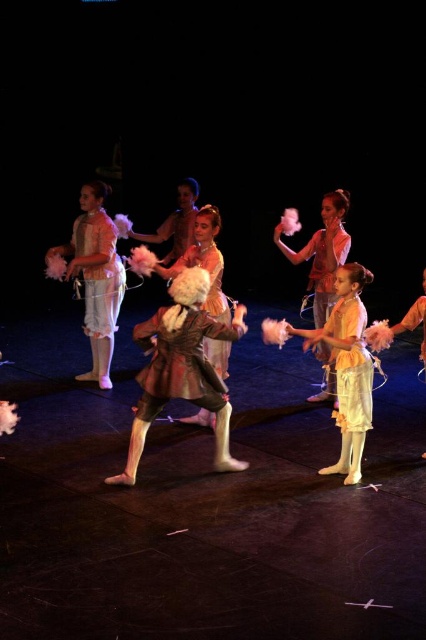
Question: Which point appears closest to the camera in this image?

Choices:
 (A) (101, 221)
 (B) (347, 376)
 (C) (218, 312)

Answer: (B)

Question: Where is matte orange dress at center located in relation to shiny silver dress at center in the image?

Choices:
 (A) below
 (B) above

Answer: (B)

Question: Which of the following is the closest to the observer?

Choices:
 (A) (325, 376)
 (B) (97, 204)

Answer: (B)

Question: Which object is the farthest from the matte pink tutu at center?

Choices:
 (A) matte yellow dress at center
 (B) shiny silver dress at center

Answer: (A)

Question: Can you confirm if matte orange dress at center is thinner than shiny silver dress at center?

Choices:
 (A) yes
 (B) no

Answer: (B)

Question: Considering the relative positions of matte yellow dress at center and shiny silver dress at center in the image provided, where is matte yellow dress at center located with respect to shiny silver dress at center?

Choices:
 (A) above
 (B) below

Answer: (B)